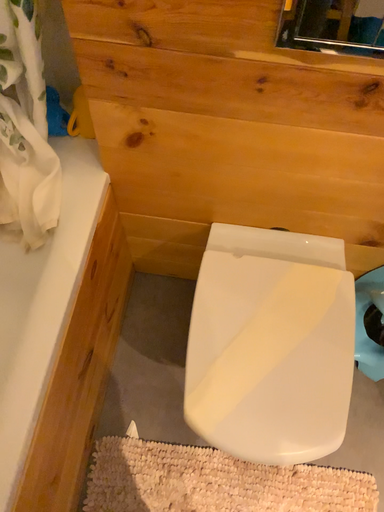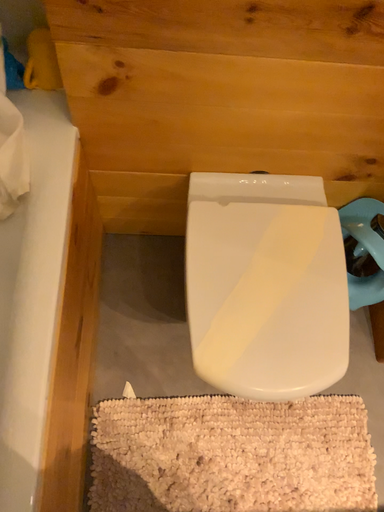
Question: How did the camera likely rotate when shooting the video?

Choices:
 (A) rotated right
 (B) rotated left

Answer: (A)